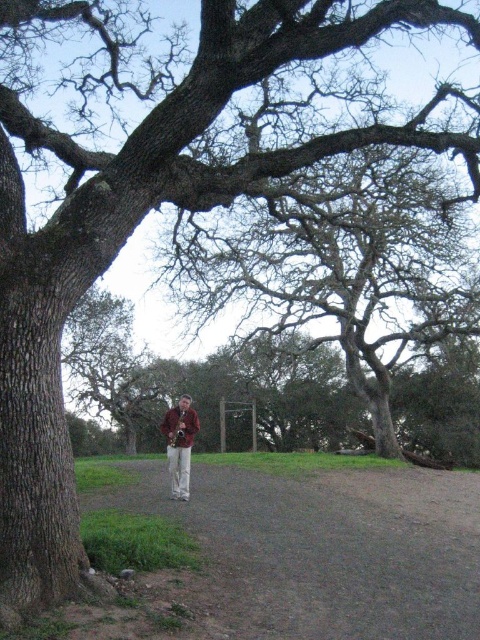
Can you confirm if brown gravel path at center is shorter than brown leather jacket at center?

Yes.

Is the position of brown gravel path at center less distant than that of brown leather jacket at center?

Yes, brown gravel path at center is closer to the viewer.

Identify the location of brown gravel path at center. (325, 548).